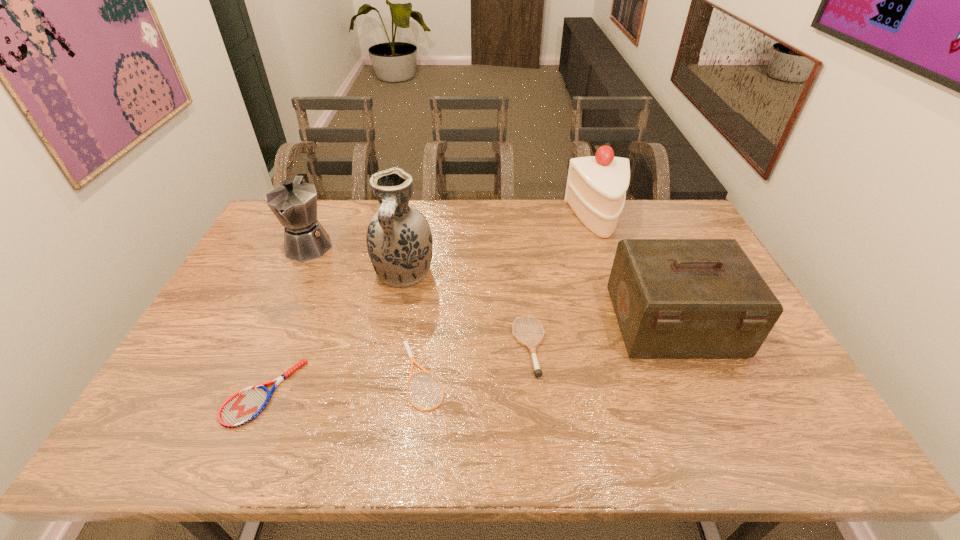
Identify the location of vase. (399, 241).

You are a GUI agent. You are given a task and a screenshot of the screen. Output one action in this format:
    pyautogui.click(x=<x>, y=<y>)
    Task: Click on the cake
    This screenshot has height=540, width=960.
    Given the screenshot: What is the action you would take?
    tap(596, 187)

What are the coordinates of `coffeepot` in the screenshot? It's located at (294, 203).

Locate an element on the screen. The image size is (960, 540). the first-aid kit is located at coordinates pos(673,298).

You are a GUI agent. You are given a task and a screenshot of the screen. Output one action in this format:
    pyautogui.click(x=<x>, y=<y>)
    Task: Click on the tallest tennis racket
    This screenshot has height=540, width=960.
    Given the screenshot: What is the action you would take?
    pyautogui.click(x=538, y=372)

Where is `the third object from right to left`? the third object from right to left is located at coordinates (538, 372).

This screenshot has width=960, height=540. In order to click on the leftmost tennis racket in this screenshot , I will do `click(245, 405)`.

The height and width of the screenshot is (540, 960). I want to click on the shortest tennis racket, so pos(405,343).

Locate an element on the screen. The image size is (960, 540). the shortest object is located at coordinates (405, 343).

The height and width of the screenshot is (540, 960). Find the location of `vacant space positioned with the handle on the side of the vase`. vacant space positioned with the handle on the side of the vase is located at coordinates (396, 315).